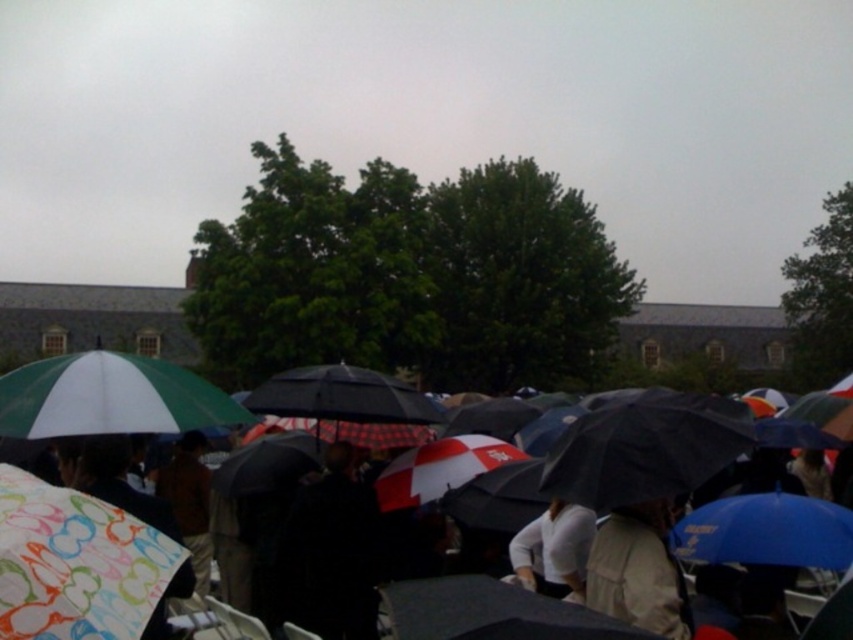
Which of these two, patterned fabric umbrella at lower left or green matte umbrella at upper left, stands shorter?

patterned fabric umbrella at lower left

Who is more distant from viewer, (140, 620) or (206, 385)?

Point (206, 385)

The width and height of the screenshot is (853, 640). Find the location of `patterned fabric umbrella at lower left`. patterned fabric umbrella at lower left is located at coordinates point(74,563).